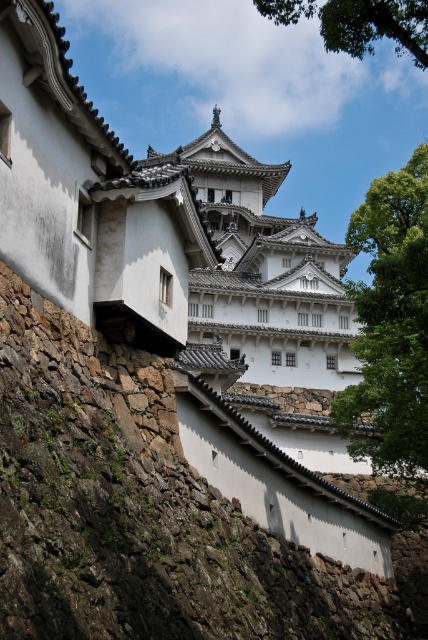
From the picture: Does white stone tower at center appear on the right side of green leafy tree at upper center?

In fact, white stone tower at center is to the left of green leafy tree at upper center.

Between point (305, 259) and point (353, 1), which one is positioned in front?

Point (353, 1) is in front.

Between point (267, 340) and point (365, 36), which one is positioned in front?

Positioned in front is point (365, 36).

You are a GUI agent. You are given a task and a screenshot of the screen. Output one action in this format:
    pyautogui.click(x=<x>, y=<y>)
    Task: Click on the white stone tower at center
    This screenshot has height=640, width=428.
    Given the screenshot: What is the action you would take?
    pyautogui.click(x=264, y=273)

Does green leafy tree at right appear under green leafy tree at upper center?

Correct, green leafy tree at right is located below green leafy tree at upper center.

Can you confirm if green leafy tree at right is shorter than green leafy tree at upper center?

Indeed, green leafy tree at right has a lesser height compared to green leafy tree at upper center.

Between point (401, 196) and point (270, 8), which one is positioned behind?

The point (401, 196) is more distant.

You are a GUI agent. You are given a task and a screenshot of the screen. Output one action in this format:
    pyautogui.click(x=<x>, y=<y>)
    Task: Click on the green leafy tree at right
    The height and width of the screenshot is (640, 428).
    Given the screenshot: What is the action you would take?
    pyautogui.click(x=391, y=323)

From the picture: Which is below, white stone tower at center or green leafy tree at right?

green leafy tree at right is lower down.

Which of these two, white stone tower at center or green leafy tree at right, stands shorter?

green leafy tree at right

Where is `white stone tower at center`? The width and height of the screenshot is (428, 640). white stone tower at center is located at coordinates (264, 273).